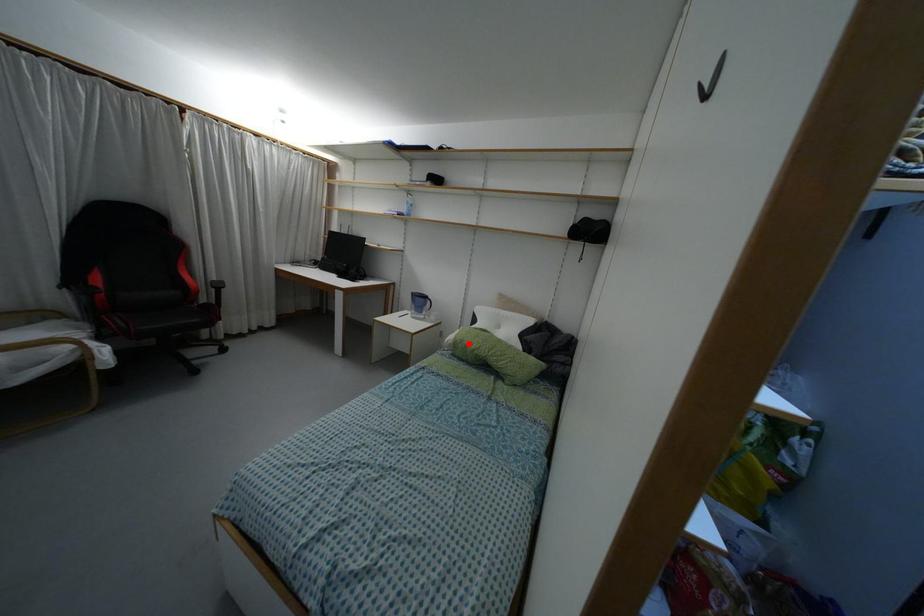
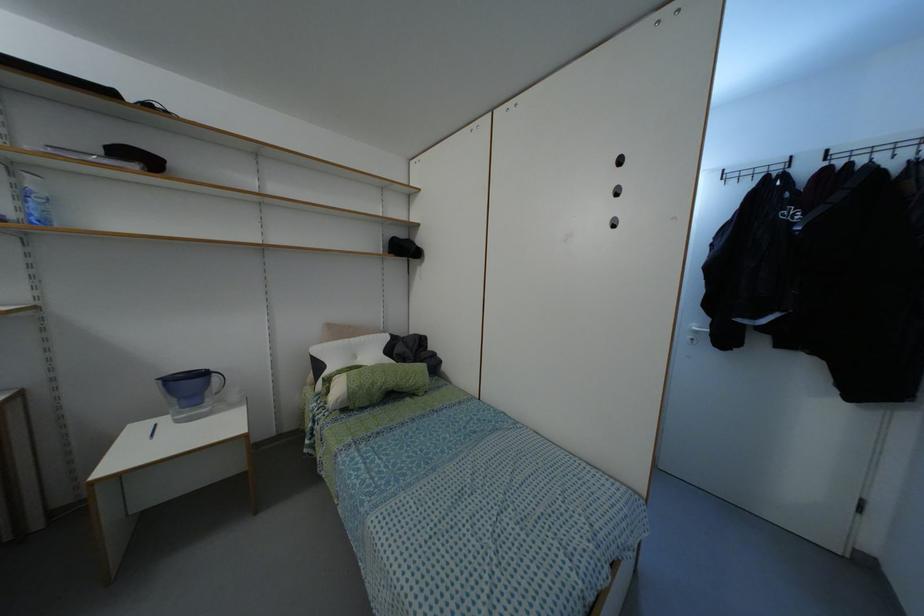
Where in the second image is the point corresponding to the highlighted location from the first image?

(371, 384)